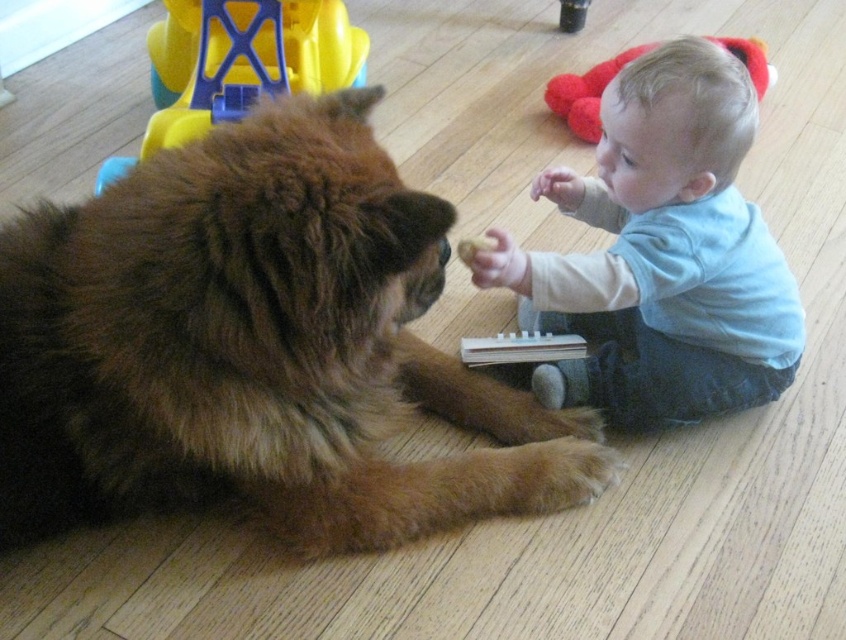
Question: Does brown fluffy dog at center appear on the right side of fuzzy fabric plush at upper right?

Choices:
 (A) no
 (B) yes

Answer: (A)

Question: Can you confirm if brown fluffy dog at center is positioned to the left of yellow crumbly food at center?

Choices:
 (A) no
 (B) yes

Answer: (B)

Question: Which object is the farthest from the brown fluffy dog at center?

Choices:
 (A) yellow plastic toy at upper left
 (B) light blue cotton shirt at center
 (C) fuzzy fabric plush at upper right

Answer: (C)

Question: Which object is positioned closest to the brown fluffy dog at center?

Choices:
 (A) yellow crumbly food at center
 (B) light blue cotton shirt at center

Answer: (B)

Question: Does fuzzy fabric plush at upper right come behind yellow crumbly food at center?

Choices:
 (A) no
 (B) yes

Answer: (B)

Question: Which is farther from the fuzzy fabric plush at upper right?

Choices:
 (A) yellow plastic toy at upper left
 (B) brown fluffy dog at center
 (C) light blue cotton shirt at center

Answer: (B)